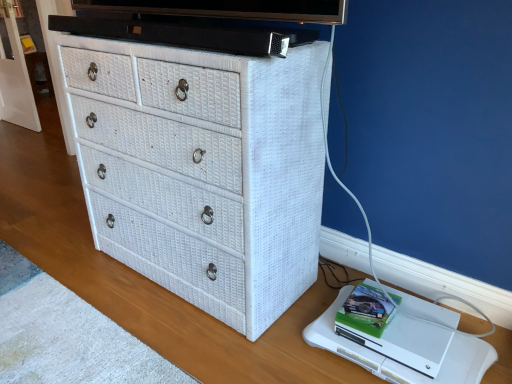
Question: Does white matte xbox one at lower right have a lesser width compared to white wicker chest of drawers at center?

Choices:
 (A) yes
 (B) no

Answer: (A)

Question: Does white matte xbox one at lower right touch white wicker chest of drawers at center?

Choices:
 (A) yes
 (B) no

Answer: (B)

Question: From the image's perspective, is white matte xbox one at lower right located beneath white wicker chest of drawers at center?

Choices:
 (A) no
 (B) yes

Answer: (B)

Question: Is white matte xbox one at lower right not near white wicker chest of drawers at center?

Choices:
 (A) yes
 (B) no

Answer: (B)

Question: Is white matte xbox one at lower right closer to camera compared to white wicker chest of drawers at center?

Choices:
 (A) yes
 (B) no

Answer: (B)

Question: From a real-world perspective, is white matte xbox one at lower right physically below white wicker chest of drawers at center?

Choices:
 (A) no
 (B) yes

Answer: (B)

Question: Is white matte xbox one at lower right at the back of white wicker chest of drawers at center?

Choices:
 (A) yes
 (B) no

Answer: (B)

Question: From a real-world perspective, is white wicker chest of drawers at center on white matte xbox one at lower right?

Choices:
 (A) yes
 (B) no

Answer: (A)

Question: Is white wicker chest of drawers at center wider than white matte xbox one at lower right?

Choices:
 (A) no
 (B) yes

Answer: (B)

Question: Is white matte xbox one at lower right located within white wicker chest of drawers at center?

Choices:
 (A) no
 (B) yes

Answer: (A)

Question: Does white wicker chest of drawers at center have a lesser width compared to white matte xbox one at lower right?

Choices:
 (A) yes
 (B) no

Answer: (B)

Question: Is white wicker chest of drawers at center positioned before white matte xbox one at lower right?

Choices:
 (A) yes
 (B) no

Answer: (A)

Question: From the image's perspective, is white matte xbox one at lower right above or below white wicker chest of drawers at center?

Choices:
 (A) below
 (B) above

Answer: (A)